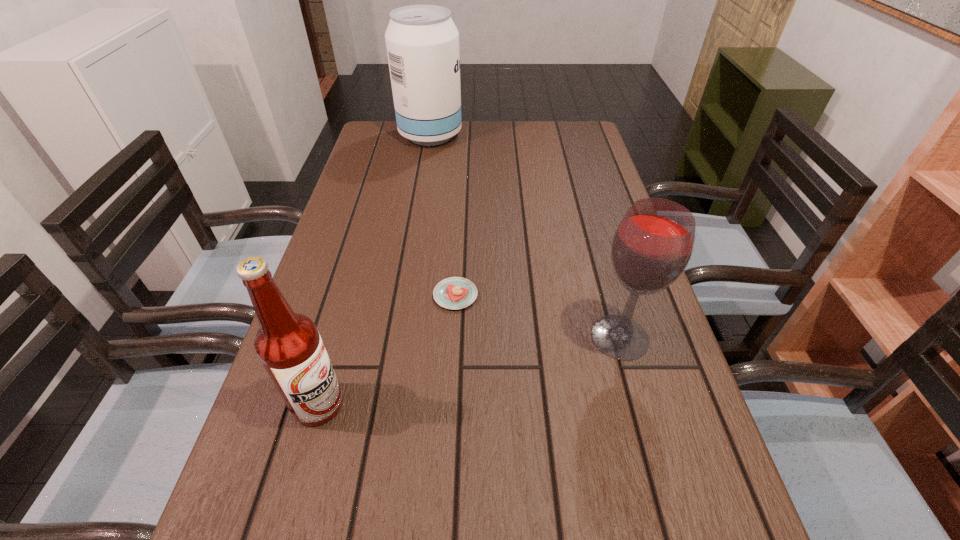
Identify the location of free space that satisfies the following two spatial constraints: 1. on the front side of the second nearest alcohol; 2. on the left side of the farthest object. (397, 337).

This screenshot has width=960, height=540. I want to click on free space that satisfies the following two spatial constraints: 1. on the front side of the farthest object; 2. on the label side of the nearest object, so click(x=386, y=404).

Image resolution: width=960 pixels, height=540 pixels. In order to click on free space that satisfies the following two spatial constraints: 1. on the front side of the farthest object; 2. on the label side of the nearest object in this screenshot , I will do tap(386, 404).